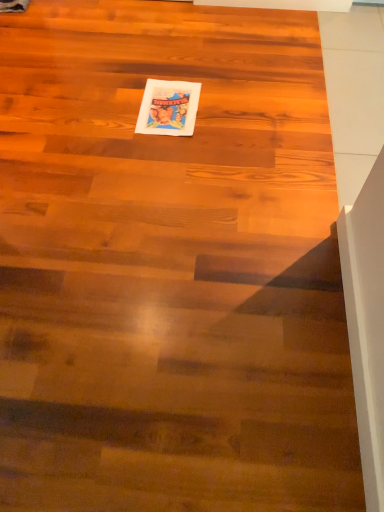
The height and width of the screenshot is (512, 384). Identify the location of vacant space situated on the left part of white paper book at center. (106, 108).